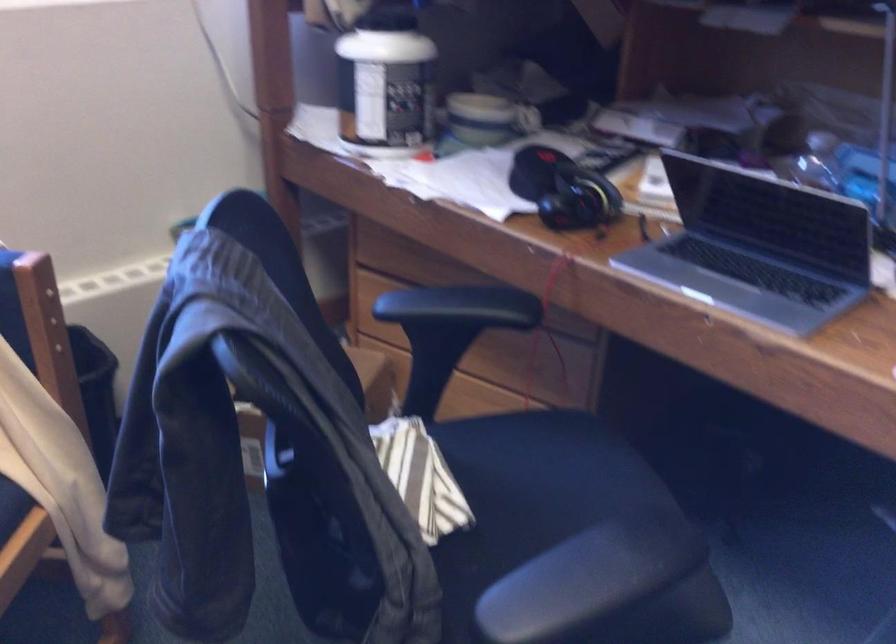
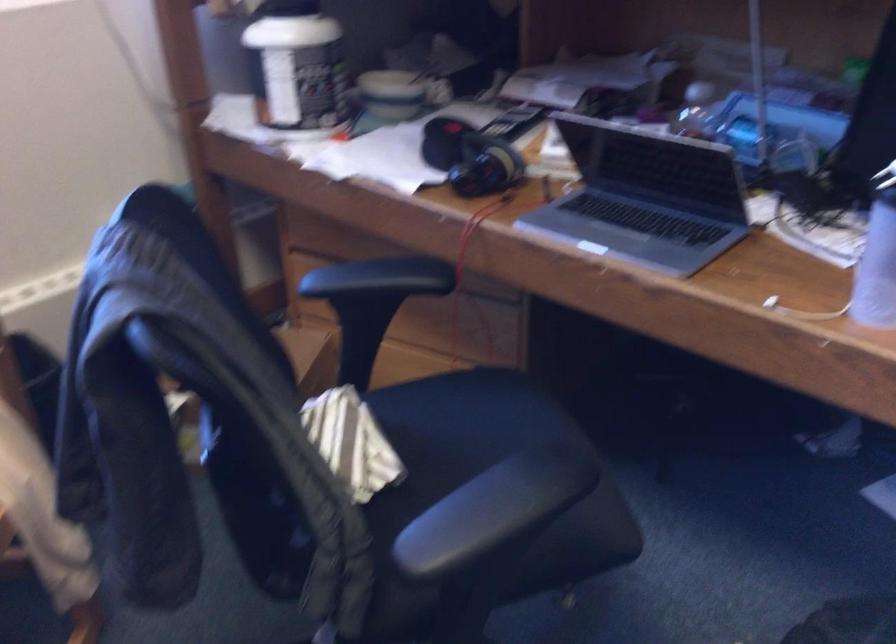
In the second image, find the point that corresponds to (x=536, y=471) in the first image.

(461, 424)